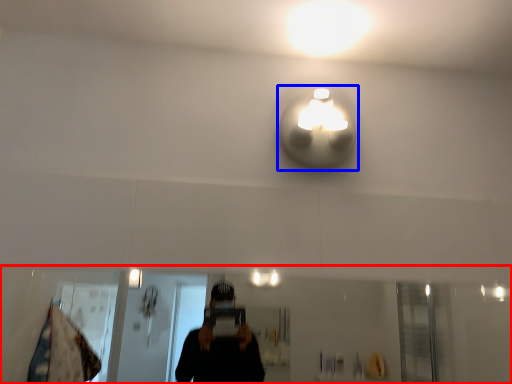
Question: Which point is further to the camera, mirror (highlighted by a red box) or light (highlighted by a blue box)?

Choices:
 (A) mirror
 (B) light

Answer: (B)